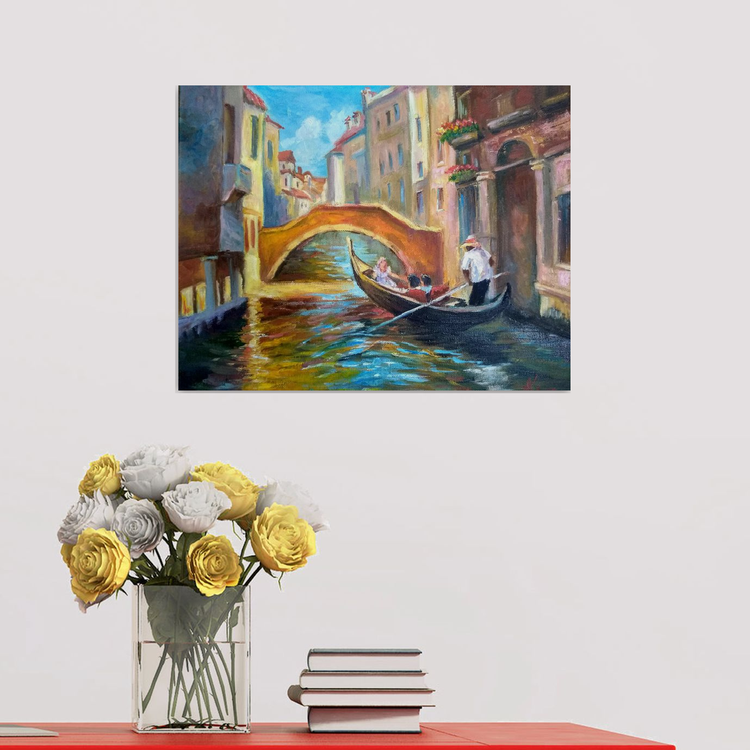
In order to click on artwork in this screenshot , I will do `click(416, 304)`.